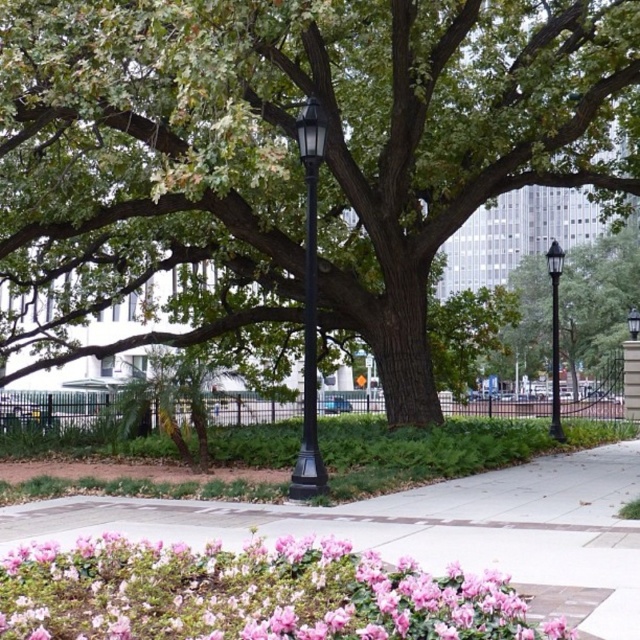
Who is positioned more to the left, pink matte flowers at lower left or black glass lamp post at center?

Positioned to the left is pink matte flowers at lower left.

Does pink matte flowers at lower left appear on the right side of black glass lamp post at center?

No, pink matte flowers at lower left is not to the right of black glass lamp post at center.

Is point (497, 576) behind point (296, 461)?

No, it is not.

I want to click on pink matte flowers at lower left, so click(250, 595).

Measure the distance between green leafy tree at center and camera.

green leafy tree at center is 9.87 meters from camera.

Identify the location of green leafy tree at center. (288, 157).

Is green matte tree at center smaller than black metal lamp post at center?

No, green matte tree at center is not smaller than black metal lamp post at center.

Does point (516, 342) come behind point (556, 406)?

Yes, point (516, 342) is farther from viewer.

At what (x,y) coordinates should I click in order to perform the action: click on green matte tree at center. Please return your answer as a coordinate pair (x, y). The height and width of the screenshot is (640, 640). Looking at the image, I should click on (598, 296).

Locate an element on the screen. green matte tree at center is located at coordinates (598, 296).